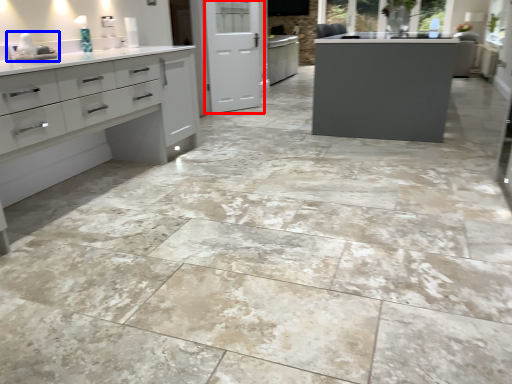
Question: Among these objects, which one is nearest to the camera, screen door (highlighted by a red box) or sink (highlighted by a blue box)?

Choices:
 (A) screen door
 (B) sink

Answer: (B)